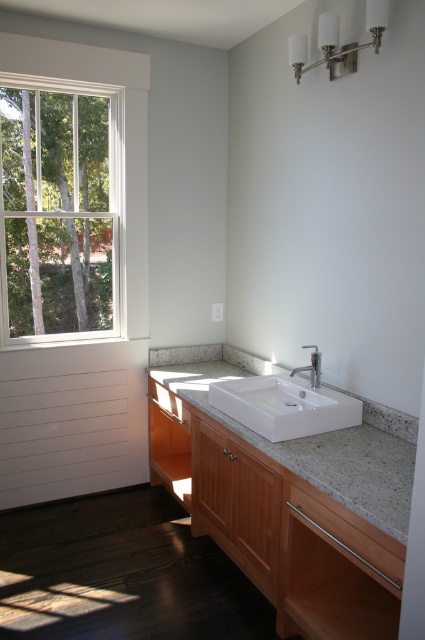
You are standing in the bathroom and want to place a decorative item on the granite countertop at center. Based on its position, where exactly should you look to place the item?

The granite countertop at center is located at point (311,436), so you should look towards those coordinates to place the decorative item there.

You are a plumber inspecting the bathroom and need to replace a part. You notice the white ceramic sink at center and the satin nickel faucet at center. Which object is taller?

The white ceramic sink at center is much taller than the satin nickel faucet at center.

You are standing in the bathroom and see two points marked on the floor. The first point is at coordinate point (337, 410) and the second point is at coordinate point (314, 353). Which point is closer to you?

Point (337, 410) is in front of point (314, 353), so the first point is closer to you.